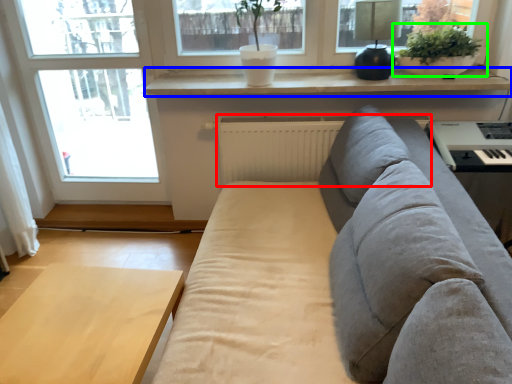
Question: Which object is the closest to the radiator (highlighted by a red box)? Choose among these: window sill (highlighted by a blue box) or houseplant (highlighted by a green box).

Choices:
 (A) window sill
 (B) houseplant

Answer: (A)